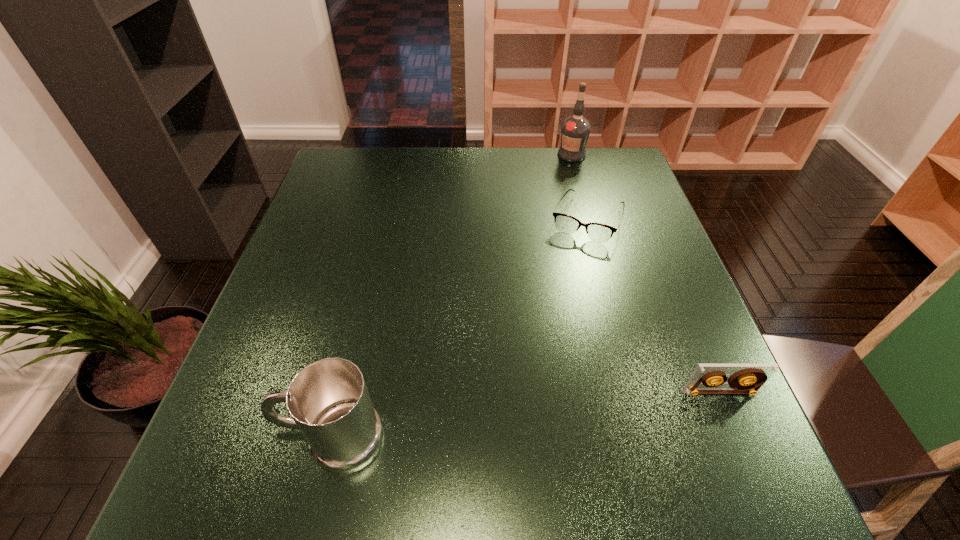
Where is `videotape that is at the right edge`? This screenshot has width=960, height=540. videotape that is at the right edge is located at coordinates (746, 378).

Where is `spectacles present at the right edge`? This screenshot has width=960, height=540. spectacles present at the right edge is located at coordinates (598, 232).

The image size is (960, 540). In order to click on vodka present at the right edge in this screenshot , I will do `click(575, 130)`.

This screenshot has height=540, width=960. In order to click on object positioned at the near left corner in this screenshot , I will do `click(328, 400)`.

Locate an element on the screen. object at the far right corner is located at coordinates [x=575, y=130].

The image size is (960, 540). Find the location of `object located in the near right corner section of the desktop`. object located in the near right corner section of the desktop is located at coordinates (746, 378).

Where is `vacant space at the far edge of the desktop`? Image resolution: width=960 pixels, height=540 pixels. vacant space at the far edge of the desktop is located at coordinates 411,154.

What are the coordinates of `free space at the near edge` in the screenshot? It's located at (635, 403).

Image resolution: width=960 pixels, height=540 pixels. In the image, there is a desktop. What are the coordinates of `free region at the left edge` in the screenshot? It's located at (345, 238).

The image size is (960, 540). I want to click on vacant region at the right edge of the desktop, so click(x=665, y=264).